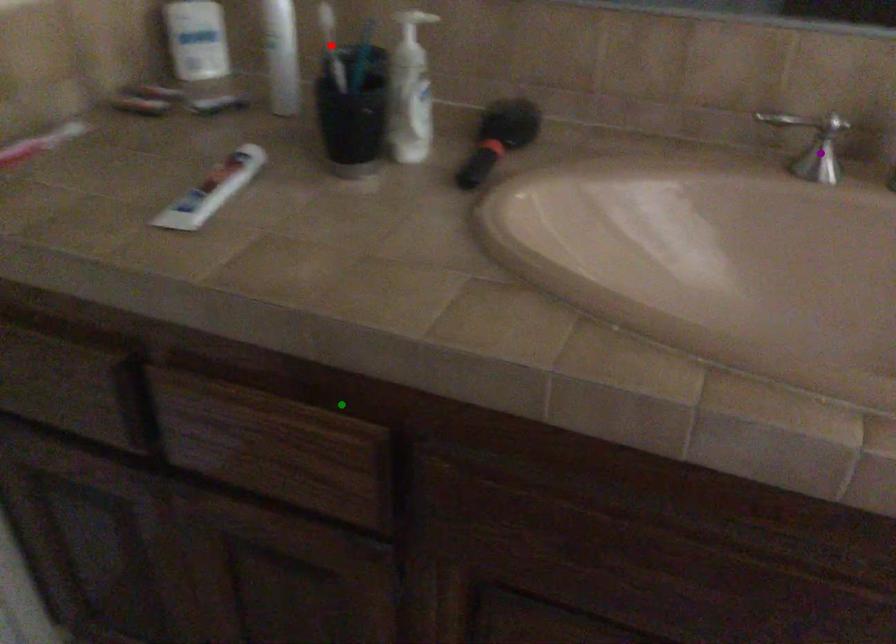
Order these from nearest to farthest:
1. green point
2. red point
3. purple point

green point, purple point, red point